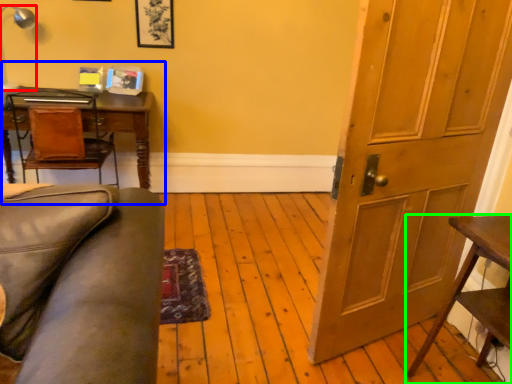
Question: Based on their relative distances, which object is farther from lamp (highlighted by a red box)? Choose from computer desk (highlighted by a blue box) and table (highlighted by a green box).

Choices:
 (A) computer desk
 (B) table

Answer: (B)